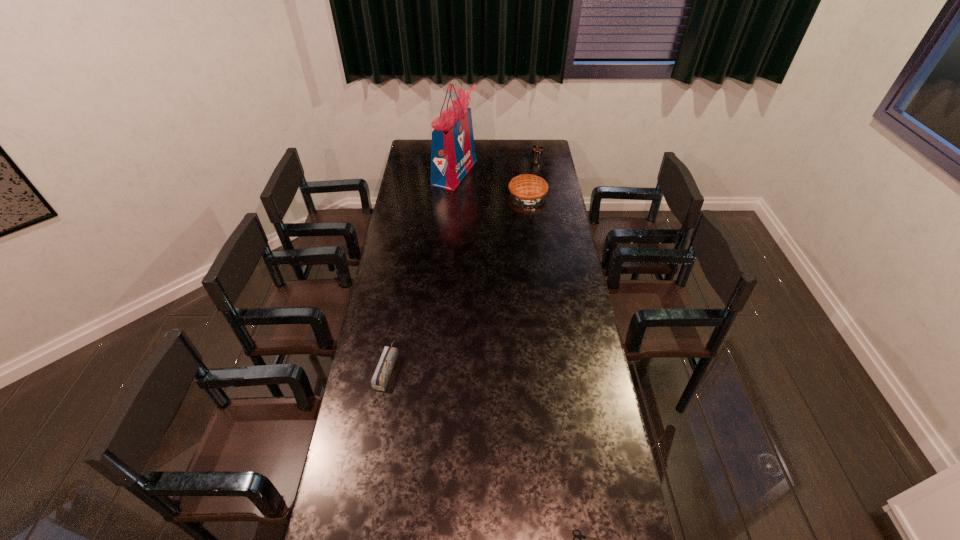
Locate an element on the screen. This screenshot has height=540, width=960. free region at the far right corner of the desktop is located at coordinates (547, 148).

The width and height of the screenshot is (960, 540). In order to click on free spot between the pencil box and the pie in this screenshot , I will do `click(457, 280)`.

This screenshot has width=960, height=540. What are the coordinates of `vacant space that's between the second shortest object and the pie` in the screenshot? It's located at (457, 280).

The height and width of the screenshot is (540, 960). Identify the location of blank region between the fourth farthest object and the can. tap(462, 265).

The image size is (960, 540). I want to click on the fourth closest object to the nearest object, so coord(537,151).

The width and height of the screenshot is (960, 540). Find the location of `the closest object to the third tallest object`. the closest object to the third tallest object is located at coordinates (537, 151).

Where is `free space that satisfies the following two spatial constraints: 1. on the back side of the pie; 2. on the right side of the pencil box`? Image resolution: width=960 pixels, height=540 pixels. free space that satisfies the following two spatial constraints: 1. on the back side of the pie; 2. on the right side of the pencil box is located at coordinates (417, 193).

The width and height of the screenshot is (960, 540). I want to click on free space in the image that satisfies the following two spatial constraints: 1. on the front-facing side of the third tallest object; 2. on the left side of the tallest object, so click(x=453, y=193).